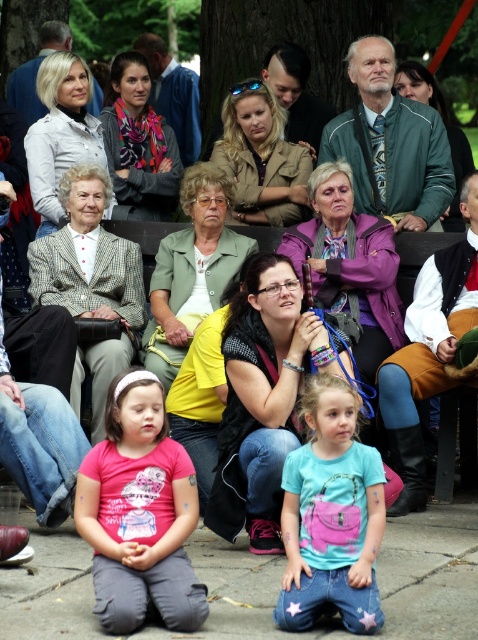
You are organizing a photography session and need to ensure that both the black leather jacket at center and the multicolored scarf at upper center are in focus. Given that your camera can only focus on objects within a 20 feet range, will both items be in focus?

The black leather jacket at center and the multicolored scarf at upper center are 32.61 feet apart, which exceeds the camera focus range of 20 feet. Therefore, both items cannot be in focus simultaneously.

You are a photographer trying to capture a clear shot of both the black leather jacket at center and the multicolored scarf at upper center. Which object should you focus on first to ensure both are in focus?

You should focus on the black leather jacket at center first since it is closer to the viewer than the multicolored scarf at upper center. By focusing on the closer object, the scarf will fall into the depth of field and remain in focus as well.

You are standing at the center of the park and see the blue denim jeans at lower center. If you walk straight towards the direction of the jeans, will you reach them before the trees in the background?

The blue denim jeans at lower center are located at point [330,515], which is closer to the observer than the trees in the background. Therefore, walking straight towards them would reach the jeans before the trees.